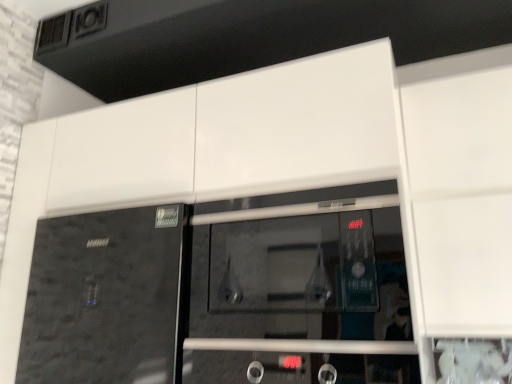
Question: From the image's perspective, would you say black glass door at center is shown under transparent glass microwave at center?

Choices:
 (A) no
 (B) yes

Answer: (B)

Question: Does black glass door at center have a smaller size compared to transparent glass microwave at center?

Choices:
 (A) no
 (B) yes

Answer: (A)

Question: Is black glass door at center completely or partially outside of transparent glass microwave at center?

Choices:
 (A) yes
 (B) no

Answer: (A)

Question: Does black glass door at center have a lesser height compared to transparent glass microwave at center?

Choices:
 (A) yes
 (B) no

Answer: (B)

Question: Is the depth of black glass door at center greater than that of transparent glass microwave at center?

Choices:
 (A) yes
 (B) no

Answer: (A)

Question: Can you confirm if black glass door at center is wider than transparent glass microwave at center?

Choices:
 (A) yes
 (B) no

Answer: (A)

Question: Could you tell me if transparent glass microwave at center is turned towards black glass door at center?

Choices:
 (A) no
 (B) yes

Answer: (A)

Question: Is transparent glass microwave at center behind black glass door at center?

Choices:
 (A) yes
 (B) no

Answer: (B)

Question: Considering the relative sizes of transparent glass microwave at center and black glass door at center in the image provided, is transparent glass microwave at center taller than black glass door at center?

Choices:
 (A) yes
 (B) no

Answer: (B)

Question: Does transparent glass microwave at center appear on the left side of black glass door at center?

Choices:
 (A) yes
 (B) no

Answer: (B)

Question: Is transparent glass microwave at center directly adjacent to black glass door at center?

Choices:
 (A) yes
 (B) no

Answer: (B)

Question: Is transparent glass microwave at center to the right of black glass door at center from the viewer's perspective?

Choices:
 (A) yes
 (B) no

Answer: (A)

Question: Looking at the image, does transparent glass microwave at center seem bigger or smaller compared to black glass door at center?

Choices:
 (A) big
 (B) small

Answer: (B)